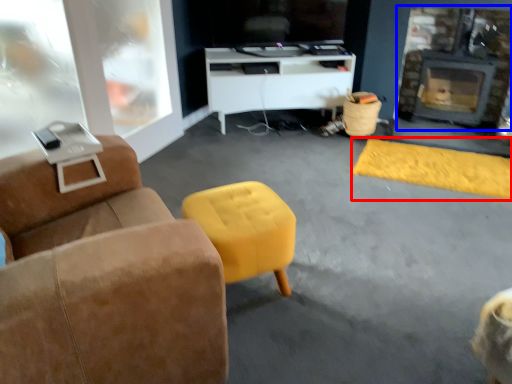
Question: Among these objects, which one is nearest to the camera, flat (highlighted by a red box) or fireplace (highlighted by a blue box)?

Choices:
 (A) flat
 (B) fireplace

Answer: (A)